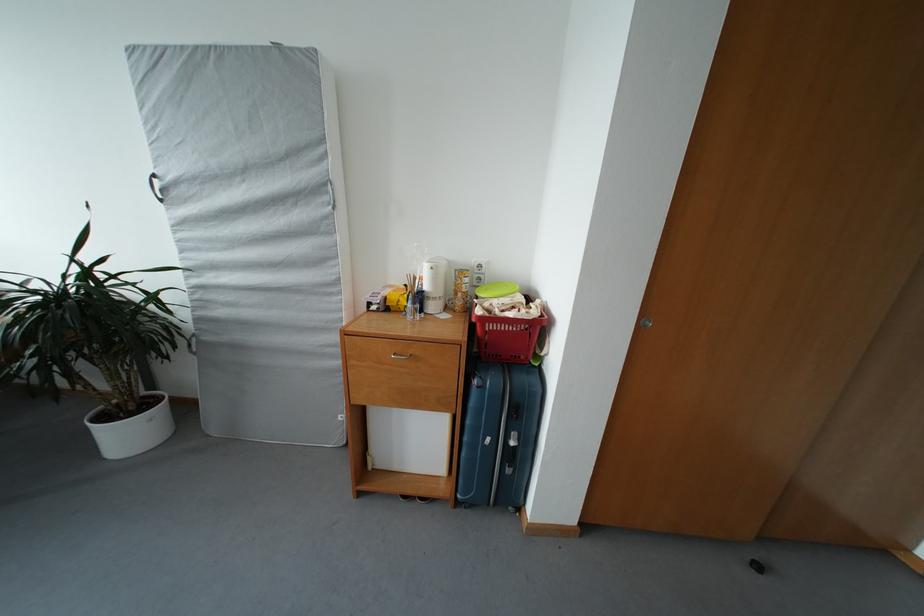
Where would you lift the white plant pot? Please return your answer as a coordinate pair (x, y).

(132, 428)